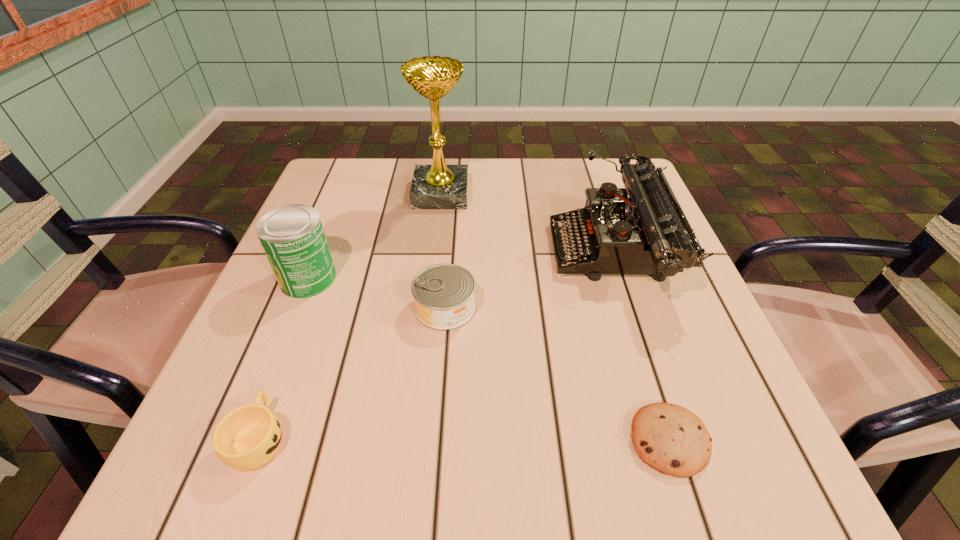
Locate an element on the screen. empty space between the third shortest object and the typewriter is located at coordinates (528, 280).

Locate which object is the fourth closest to the taller can. Please provide its 2D coordinates. Your answer should be formatted as a tuple, i.e. [(x, y)], where the tuple contains the x and y coordinates of a point satisfying the conditions above.

[(645, 234)]

At what (x,y) coordinates should I click in order to perform the action: click on the fourth closest object to the award. Please return your answer as a coordinate pair (x, y). The width and height of the screenshot is (960, 540). Looking at the image, I should click on (246, 438).

Identify the location of free location that satisfies the following two spatial constraints: 1. on the front-facing side of the tallest object; 2. on the back side of the shorter can. The image size is (960, 540). (428, 307).

I want to click on free location that satisfies the following two spatial constraints: 1. on the front-facing side of the shorter can; 2. on the right side of the award, so click(428, 307).

Locate an element on the screen. The width and height of the screenshot is (960, 540). vacant area in the image that satisfies the following two spatial constraints: 1. on the front-facing side of the award; 2. on the back side of the shorter can is located at coordinates (428, 307).

I want to click on free location that satisfies the following two spatial constraints: 1. on the front-facing side of the award; 2. on the left side of the cookie, so click(413, 440).

Identify the location of blank space that satisfies the following two spatial constraints: 1. on the back side of the fifth tallest object; 2. on the left side of the right can. (308, 307).